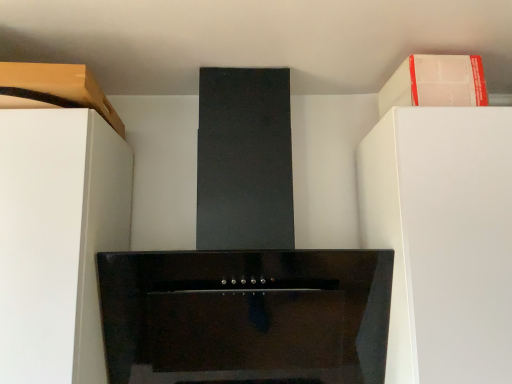
Describe the element at coordinates (435, 82) in the screenshot. This screenshot has height=384, width=512. I see `white matte cabinet at upper right, the 2th cabinetry when ordered from left to right` at that location.

What is the approximate width of white matte cabinet at upper right, the 2th cabinetry when ordered from left to right?

The width of white matte cabinet at upper right, the 2th cabinetry when ordered from left to right, is 21.67 centimeters.

The width and height of the screenshot is (512, 384). Find the location of `white matte cabinet at left`. white matte cabinet at left is located at coordinates (58, 240).

The width and height of the screenshot is (512, 384). What are the coordinates of `matte wood cabinet at upper left, placed as the 2th cabinetry when sorted from right to left` in the screenshot? It's located at (54, 89).

Is white matte cabinet at upper right, the 2th cabinetry when ordered from left to right, inside the boundaries of white matte cabinet at left, or outside?

white matte cabinet at upper right, the 2th cabinetry when ordered from left to right, is spatially situated outside white matte cabinet at left.

In the scene shown: Between white matte cabinet at upper right, acting as the first cabinetry starting from the right, and white matte cabinet at left, which one has smaller size?

With smaller size is white matte cabinet at upper right, acting as the first cabinetry starting from the right.

From a real-world perspective, is white matte cabinet at upper right, the 2th cabinetry when ordered from left to right, over white matte cabinet at left?

Yes.

Considering the relative sizes of white matte cabinet at left and white matte cabinet at upper right, acting as the first cabinetry starting from the right, in the image provided, is white matte cabinet at left taller than white matte cabinet at upper right, acting as the first cabinetry starting from the right,?

Indeed, white matte cabinet at left has a greater height compared to white matte cabinet at upper right, acting as the first cabinetry starting from the right.

Is white matte cabinet at left beside white matte cabinet at upper right, acting as the first cabinetry starting from the right?

No.

In the scene shown: From the image's perspective, who appears lower, white matte cabinet at left or white matte cabinet at upper right, the 2th cabinetry when ordered from left to right?

white matte cabinet at left.

Considering the points (87, 175) and (441, 86), which point is behind, point (87, 175) or point (441, 86)?

The point (441, 86) is more distant.

Is matte wood cabinet at upper left, which is counted as the first cabinetry, starting from the left, wider than white matte cabinet at left?

Correct, the width of matte wood cabinet at upper left, which is counted as the first cabinetry, starting from the left, exceeds that of white matte cabinet at left.

Is matte wood cabinet at upper left, placed as the 2th cabinetry when sorted from right to left, closer to the viewer compared to white matte cabinet at left?

No, the depth of matte wood cabinet at upper left, placed as the 2th cabinetry when sorted from right to left, is greater than that of white matte cabinet at left.

Could you measure the distance between matte wood cabinet at upper left, which is counted as the first cabinetry, starting from the left, and white matte cabinet at left?

matte wood cabinet at upper left, which is counted as the first cabinetry, starting from the left, and white matte cabinet at left are 8.45 inches apart from each other.

Which is closer, (21,66) or (68,331)?

Point (21,66) is farther from the camera than point (68,331).

Is white matte cabinet at upper right, the 2th cabinetry when ordered from left to right, further to camera compared to matte wood cabinet at upper left, placed as the 2th cabinetry when sorted from right to left?

Yes.

Between white matte cabinet at upper right, the 2th cabinetry when ordered from left to right, and matte wood cabinet at upper left, placed as the 2th cabinetry when sorted from right to left, which one has larger width?

matte wood cabinet at upper left, placed as the 2th cabinetry when sorted from right to left.

Is the surface of white matte cabinet at upper right, the 2th cabinetry when ordered from left to right, in direct contact with matte wood cabinet at upper left, which is counted as the first cabinetry, starting from the left?

white matte cabinet at upper right, the 2th cabinetry when ordered from left to right, and matte wood cabinet at upper left, which is counted as the first cabinetry, starting from the left, are not in contact.

How much distance is there between white matte cabinet at upper right, the 2th cabinetry when ordered from left to right, and matte wood cabinet at upper left, which is counted as the first cabinetry, starting from the left?

white matte cabinet at upper right, the 2th cabinetry when ordered from left to right, and matte wood cabinet at upper left, which is counted as the first cabinetry, starting from the left, are 28.01 inches apart from each other.

Between white matte cabinet at left and matte wood cabinet at upper left, placed as the 2th cabinetry when sorted from right to left, which one is positioned behind?

Positioned behind is matte wood cabinet at upper left, placed as the 2th cabinetry when sorted from right to left.

Locate an element on the screen. This screenshot has height=384, width=512. cabinetry located on the left of white matte cabinet at left is located at coordinates (54, 89).

Is white matte cabinet at left inside or outside of matte wood cabinet at upper left, placed as the 2th cabinetry when sorted from right to left?

The correct answer is: outside.

Is white matte cabinet at left wider or thinner than matte wood cabinet at upper left, which is counted as the first cabinetry, starting from the left?

white matte cabinet at left is thinner than matte wood cabinet at upper left, which is counted as the first cabinetry, starting from the left.

Which object is wider, matte wood cabinet at upper left, which is counted as the first cabinetry, starting from the left, or white matte cabinet at upper right, the 2th cabinetry when ordered from left to right?

With larger width is matte wood cabinet at upper left, which is counted as the first cabinetry, starting from the left.

Can you tell me how much matte wood cabinet at upper left, placed as the 2th cabinetry when sorted from right to left, and white matte cabinet at upper right, acting as the first cabinetry starting from the right, differ in facing direction?

2.57 degrees.

Is point (106, 106) behind point (485, 98)?

Yes, point (106, 106) is behind point (485, 98).

Is white matte cabinet at upper right, acting as the first cabinetry starting from the right, at the back of matte wood cabinet at upper left, which is counted as the first cabinetry, starting from the left?

No, matte wood cabinet at upper left, which is counted as the first cabinetry, starting from the left,'s orientation is not away from white matte cabinet at upper right, acting as the first cabinetry starting from the right.

Where is `furniture located on the left of white matte cabinet at upper right, the 2th cabinetry when ordered from left to right`? This screenshot has height=384, width=512. furniture located on the left of white matte cabinet at upper right, the 2th cabinetry when ordered from left to right is located at coordinates (58, 240).

In the image, there is a white matte cabinet at upper right, the 2th cabinetry when ordered from left to right. At what (x,y) coordinates should I click in order to perform the action: click on furniture below it (from the image's perspective). Please return your answer as a coordinate pair (x, y). The image size is (512, 384). Looking at the image, I should click on (58, 240).

In the scene shown: Considering their positions, is white matte cabinet at upper right, the 2th cabinetry when ordered from left to right, positioned closer to matte wood cabinet at upper left, which is counted as the first cabinetry, starting from the left, than white matte cabinet at left?

Among the two, white matte cabinet at left is located nearer to matte wood cabinet at upper left, which is counted as the first cabinetry, starting from the left.

Looking at the image, which one is located further to white matte cabinet at upper right, acting as the first cabinetry starting from the right, white matte cabinet at left or matte wood cabinet at upper left, placed as the 2th cabinetry when sorted from right to left?

white matte cabinet at left is positioned further to the anchor white matte cabinet at upper right, acting as the first cabinetry starting from the right.

Which object lies further to the anchor point matte wood cabinet at upper left, which is counted as the first cabinetry, starting from the left, white matte cabinet at left or white matte cabinet at upper right, the 2th cabinetry when ordered from left to right?

The object further to matte wood cabinet at upper left, which is counted as the first cabinetry, starting from the left, is white matte cabinet at upper right, the 2th cabinetry when ordered from left to right.

Which object lies further to the anchor point white matte cabinet at left, matte wood cabinet at upper left, placed as the 2th cabinetry when sorted from right to left, or white matte cabinet at upper right, acting as the first cabinetry starting from the right?

white matte cabinet at upper right, acting as the first cabinetry starting from the right.

Looking at the image, which one is located further to white matte cabinet at left, white matte cabinet at upper right, the 2th cabinetry when ordered from left to right, or matte wood cabinet at upper left, placed as the 2th cabinetry when sorted from right to left?

The object further to white matte cabinet at left is white matte cabinet at upper right, the 2th cabinetry when ordered from left to right.

When comparing their distances from white matte cabinet at upper right, acting as the first cabinetry starting from the right, does matte wood cabinet at upper left, which is counted as the first cabinetry, starting from the left, or white matte cabinet at left seem further?

white matte cabinet at left lies further to white matte cabinet at upper right, acting as the first cabinetry starting from the right, than the other object.

Locate an element on the screen. Image resolution: width=512 pixels, height=384 pixels. furniture situated between matte wood cabinet at upper left, which is counted as the first cabinetry, starting from the left, and white matte cabinet at upper right, acting as the first cabinetry starting from the right, from left to right is located at coordinates (58, 240).